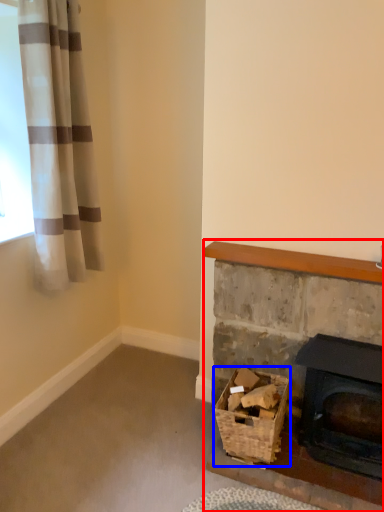
Question: Among these objects, which one is nearest to the camera, fireplace (highlighted by a red box) or basket (highlighted by a blue box)?

Choices:
 (A) fireplace
 (B) basket

Answer: (A)